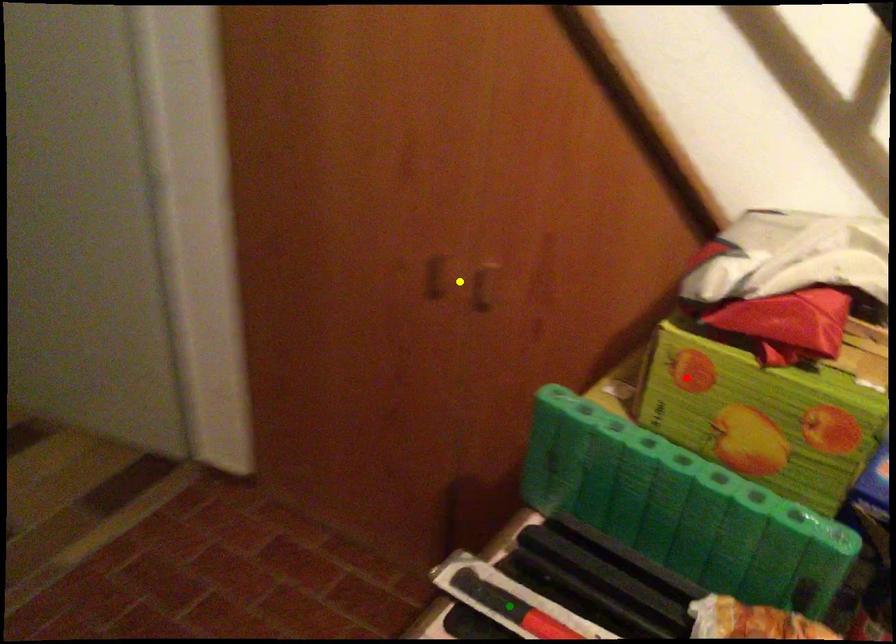
Order these from nearest to farthest:
1. yellow point
2. red point
3. green point

green point < red point < yellow point